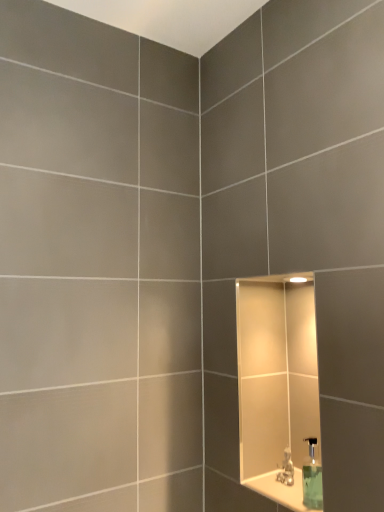
The height and width of the screenshot is (512, 384). What are the coordinates of `free spot behind green translucent soap dispenser at lower right` in the screenshot? It's located at (289, 495).